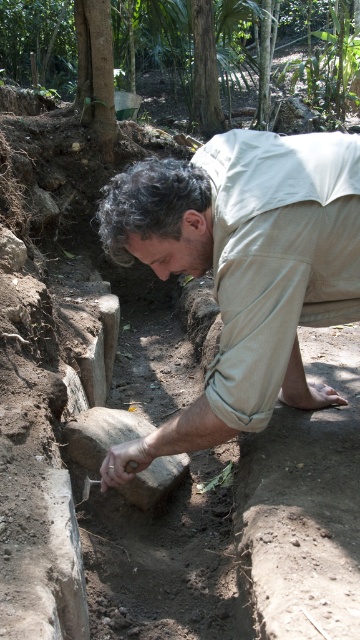
Question: Which point is farther to the camera?

Choices:
 (A) brown leather glove at lower center
 (B) smooth gray stone at lower center
 (C) beige cotton shirt at center

Answer: (B)

Question: Is beige cotton shirt at center to the right of brown leather glove at lower center from the viewer's perspective?

Choices:
 (A) yes
 (B) no

Answer: (A)

Question: Which point appears farthest from the camera in this image?

Choices:
 (A) (127, 476)
 (B) (79, 456)

Answer: (B)

Question: Considering the real-world distances, which object is closest to the smooth gray stone at lower center?

Choices:
 (A) beige cotton shirt at center
 (B) brown leather glove at lower center

Answer: (B)

Question: Can you confirm if smooth gray stone at lower center is positioned to the left of brown leather glove at lower center?

Choices:
 (A) no
 (B) yes

Answer: (B)

Question: Observing the image, what is the correct spatial positioning of beige cotton shirt at center in reference to brown leather glove at lower center?

Choices:
 (A) right
 (B) left

Answer: (A)